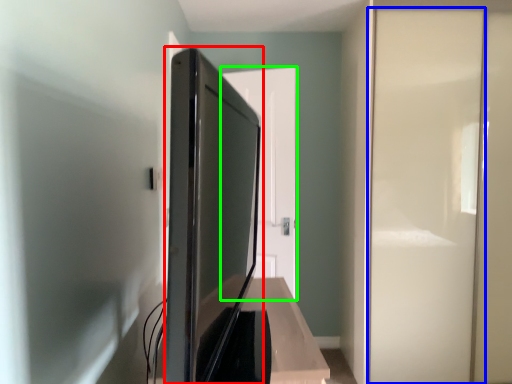
Question: Which is farther away from appliance (highlighted by a red box)? screen door (highlighted by a blue box) or door (highlighted by a green box)?

Choices:
 (A) screen door
 (B) door

Answer: (A)